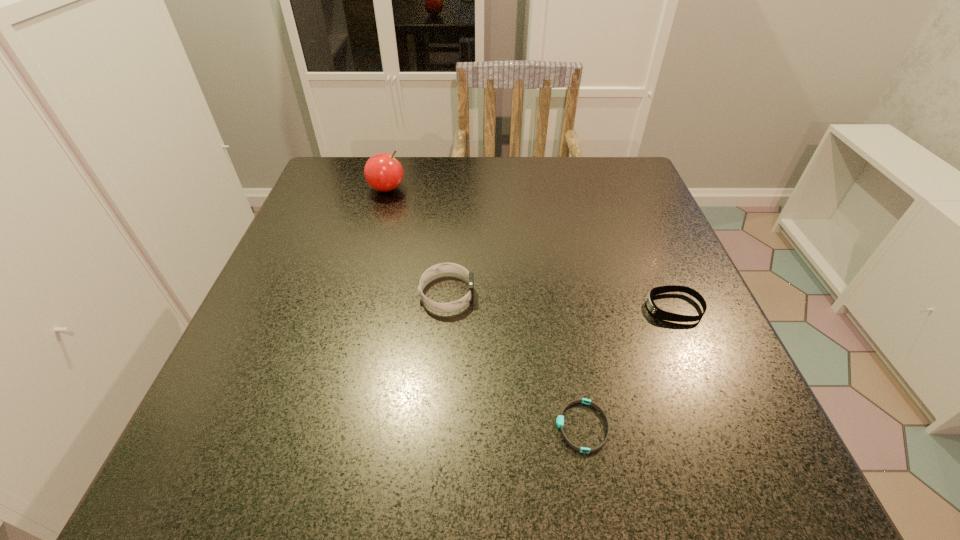
Locate an element on the screen. The width and height of the screenshot is (960, 540). wristband that is the second closest to the second tallest object is located at coordinates (657, 312).